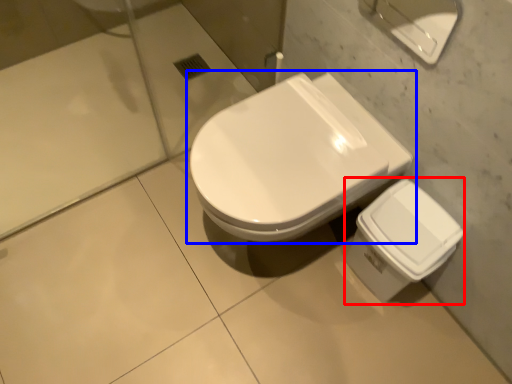
Question: Which object appears farthest to the camera in this image, porcelain (highlighted by a red box) or toilet (highlighted by a blue box)?

Choices:
 (A) porcelain
 (B) toilet

Answer: (A)